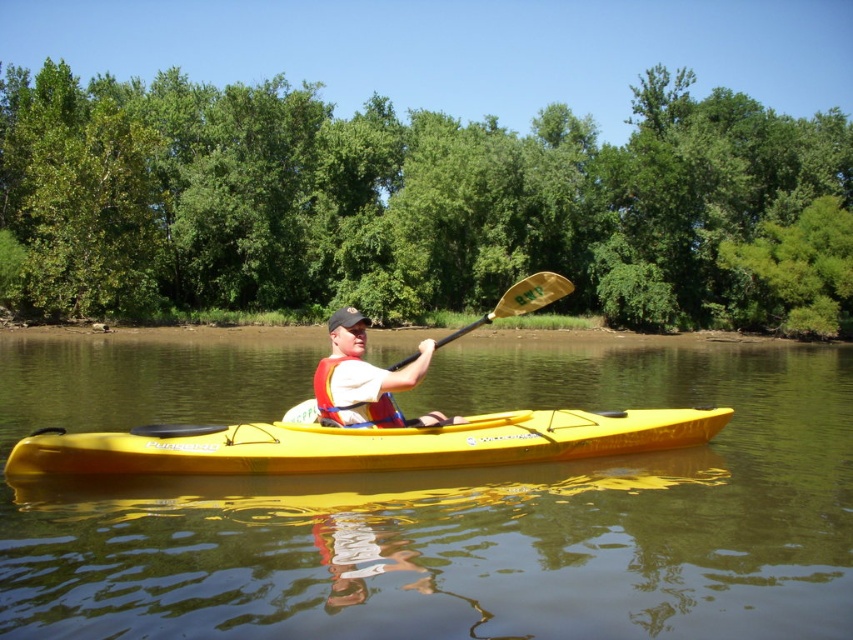
Question: Which object is positioned closest to the matte white life vest at center?

Choices:
 (A) gold textured paddle at center
 (B) red life jacket at center

Answer: (A)

Question: Where is yellow matte kayak at center located in relation to gold textured paddle at center in the image?

Choices:
 (A) left
 (B) right

Answer: (A)

Question: Which of the following is the farthest from the observer?

Choices:
 (A) (532, 284)
 (B) (679, 493)

Answer: (B)

Question: Considering the real-world distances, which object is closest to the gold textured paddle at center?

Choices:
 (A) red life jacket at center
 (B) yellow plastic kayak at center
 (C) wooden textured paddle at center

Answer: (C)

Question: Is yellow plastic kayak at center to the left of matte white life vest at center from the viewer's perspective?

Choices:
 (A) yes
 (B) no

Answer: (B)

Question: Does matte white life vest at center have a larger size compared to red life jacket at center?

Choices:
 (A) yes
 (B) no

Answer: (A)